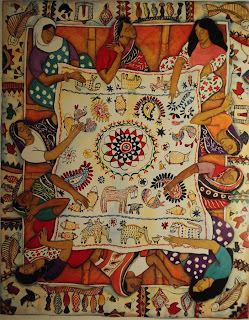
Identify the location of group of vases. (77, 301), (157, 9), (7, 196).